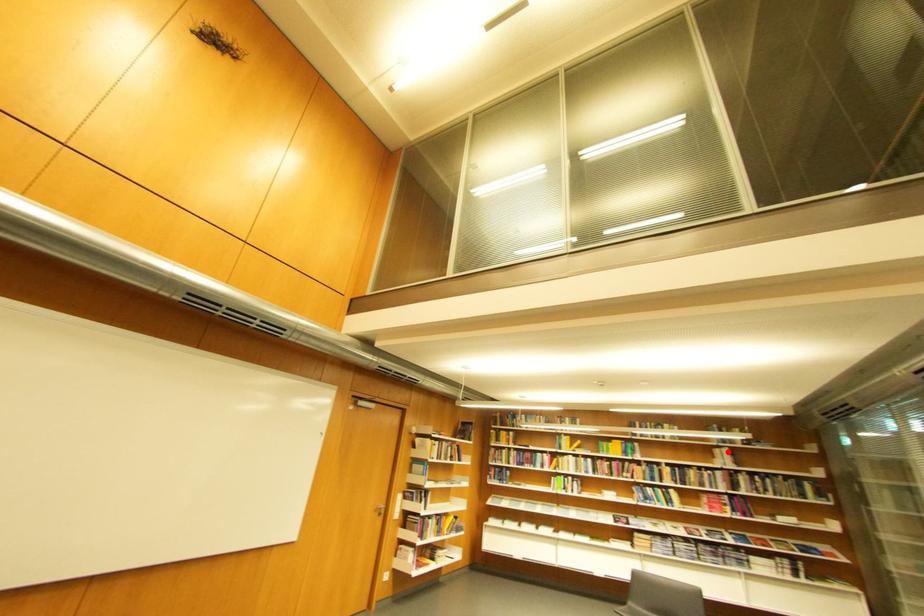
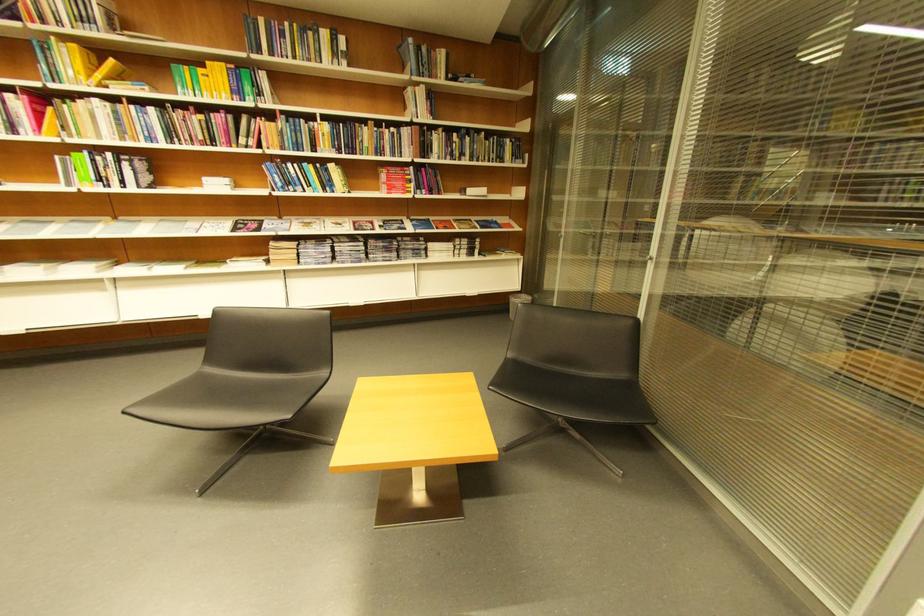
Question: A red point is marked in image1. In image2, is the corresponding 3D point closer to the camera or farther? Reply with the corresponding letter.

Choices:
 (A) The corresponding 3D point is closer.
 (B) The corresponding 3D point is farther.

Answer: (A)